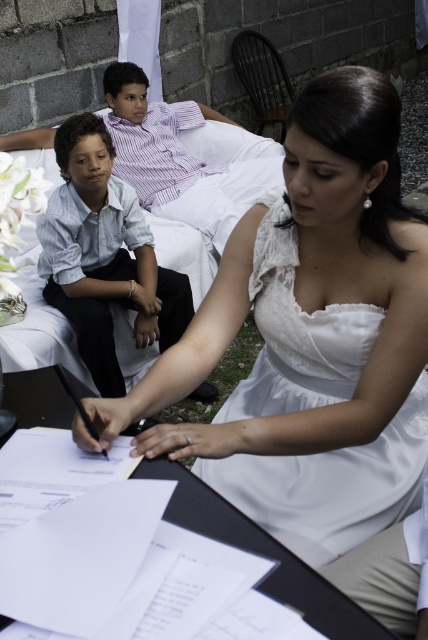
Is white satin dress at center closer to camera compared to striped cotton shirt at left?

Yes, it is in front of striped cotton shirt at left.

Which is above, white satin dress at center or striped cotton shirt at left?

striped cotton shirt at left

Where is `white satin dress at center`? Image resolution: width=428 pixels, height=640 pixels. white satin dress at center is located at coordinates tap(330, 484).

You are a GUI agent. You are given a task and a screenshot of the screen. Output one action in this format:
    pyautogui.click(x=<x>, y=<y>)
    Task: Click on the white satin dress at center
    The image size is (428, 640).
    Given the screenshot: What is the action you would take?
    (x=330, y=484)

Is white paper at center thinner than striped cotton shirt at left?

Indeed, white paper at center has a lesser width compared to striped cotton shirt at left.

At what (x,y) coordinates should I click in order to perform the action: click on white paper at center. Please return your answer as a coordinate pair (x, y). This screenshot has width=428, height=640. Looking at the image, I should click on (89, 561).

Which of these two, white satin dress at center or white paper at center, stands shorter?

white paper at center

Who is taller, white satin dress at center or white paper at center?

With more height is white satin dress at center.

Which is behind, point (424, 426) or point (350, 636)?

Positioned behind is point (424, 426).

In order to click on white satin dress at center in this screenshot , I will do `click(330, 484)`.